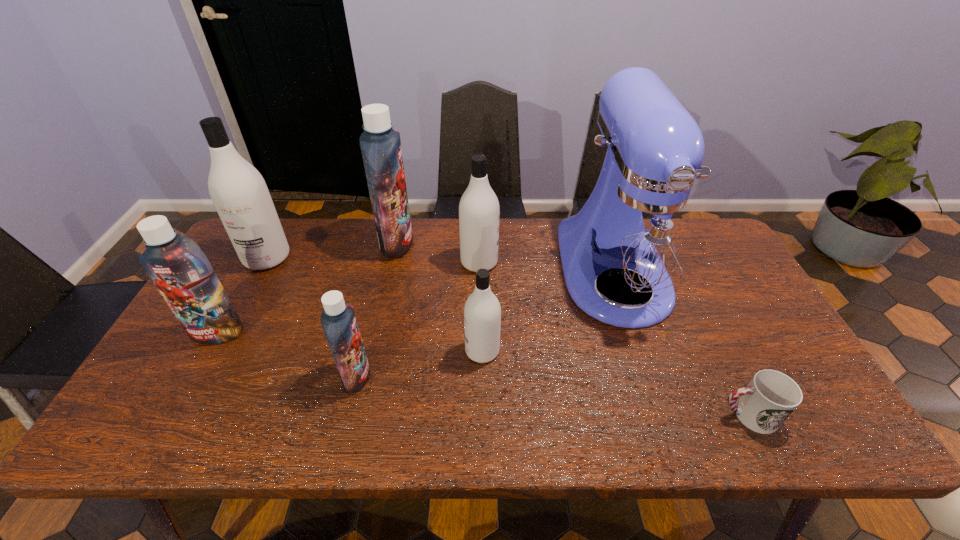
Locate an element on the screen. The image size is (960, 540). vacant space that satisfies the following two spatial constraints: 1. on the front label of the biggest blue shampoo; 2. on the front-facing side of the biggest white shampoo is located at coordinates (394, 258).

Image resolution: width=960 pixels, height=540 pixels. Find the location of `vacant space that satisfies the following two spatial constraints: 1. on the side of the cup where the handle is located; 2. on the front-facing side of the biggest white shampoo`. vacant space that satisfies the following two spatial constraints: 1. on the side of the cup where the handle is located; 2. on the front-facing side of the biggest white shampoo is located at coordinates (671, 258).

This screenshot has width=960, height=540. Find the location of `vacant space that satisfies the following two spatial constraints: 1. at the mixing area of the mixer; 2. on the front label of the smallest blue shampoo`. vacant space that satisfies the following two spatial constraints: 1. at the mixing area of the mixer; 2. on the front label of the smallest blue shampoo is located at coordinates (648, 375).

Find the location of `vacant point that satisfies the following two spatial constraints: 1. on the side of the cup where the handle is located; 2. on the front label of the second nearest blue shampoo`. vacant point that satisfies the following two spatial constraints: 1. on the side of the cup where the handle is located; 2. on the front label of the second nearest blue shampoo is located at coordinates (708, 333).